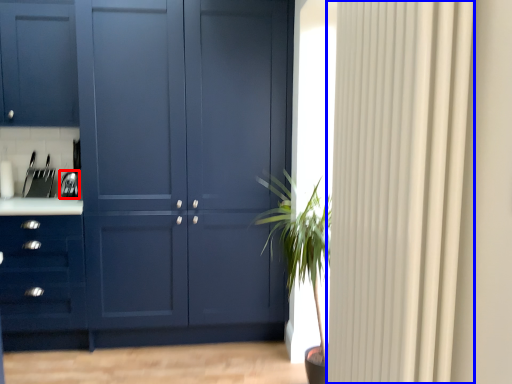
Question: Which of the following is the closest to the observer, appliance (highlighted by a red box) or curtain (highlighted by a blue box)?

Choices:
 (A) appliance
 (B) curtain

Answer: (B)